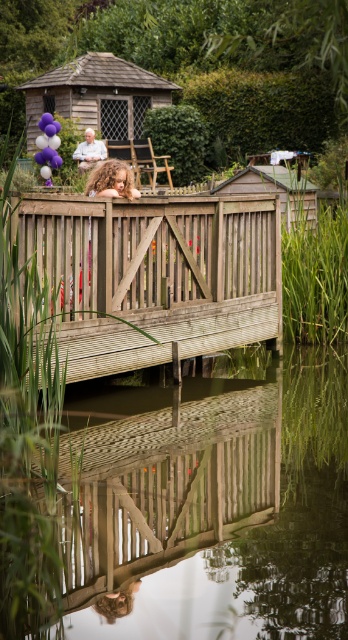
You are a photographer standing at the bridge, and you want to take a photo of the curly blonde hair at upper center and the matte white shirt at upper center in the same frame. Can you fit both objects into the photo if your camera has a 50mm lens?

The curly blonde hair at upper center and the matte white shirt at upper center are 15.36 meters apart from each other. With a 50mm lens, which has a standard field of view, it is unlikely that both objects can be captured in the same frame due to the significant distance between them.